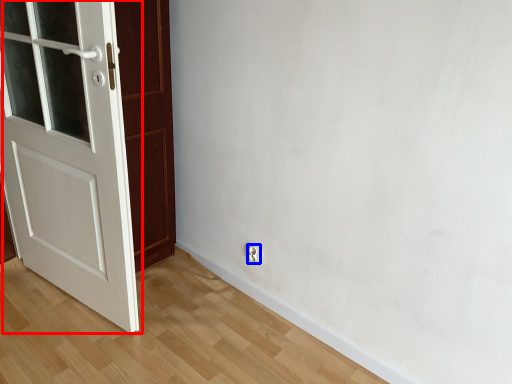
Question: Which object is further to the camera taking this photo, door (highlighted by a red box) or electric outlet (highlighted by a blue box)?

Choices:
 (A) door
 (B) electric outlet

Answer: (B)